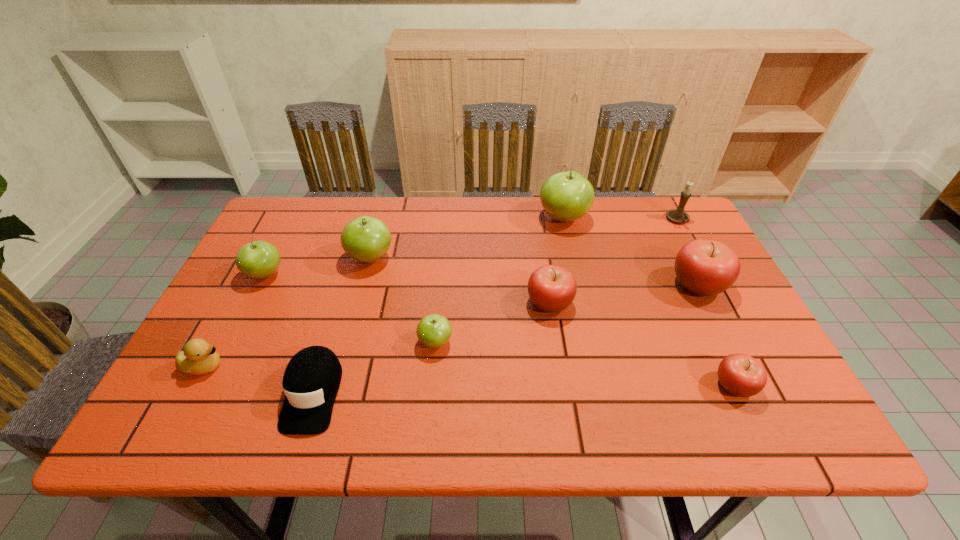
You are a GUI agent. You are given a task and a screenshot of the screen. Output one action in this format:
    pyautogui.click(x=<x>, y=<y>)
    Task: Click on the free space located 0.390m on the right of the leftmost red apple
    Image resolution: width=960 pixels, height=540 pixels.
    Given the screenshot: What is the action you would take?
    pyautogui.click(x=726, y=302)

You are a GUI agent. You are given a task and a screenshot of the screen. Output one action in this format:
    pyautogui.click(x=<x>, y=<y>)
    Task: Click on the vacant region located on the front of the second green apple from right to left
    This screenshot has height=540, width=960.
    Given the screenshot: What is the action you would take?
    pyautogui.click(x=429, y=412)

Where is `vacant space located 0.230m facing forward on the duckling`? The image size is (960, 540). vacant space located 0.230m facing forward on the duckling is located at coordinates (328, 366).

I want to click on vacant space located 0.280m on the back of the nearest red apple, so click(684, 280).

Where is `candle holder that is at the far edge`? The image size is (960, 540). candle holder that is at the far edge is located at coordinates (678, 215).

This screenshot has height=540, width=960. Find the location of `apple situated at the near edge`. apple situated at the near edge is located at coordinates tap(739, 374).

This screenshot has height=540, width=960. I want to click on cap that is at the near edge, so click(311, 380).

Where is `apple that is at the left edge`? apple that is at the left edge is located at coordinates (259, 259).

This screenshot has height=540, width=960. I want to click on duckling located in the left edge section of the desktop, so click(198, 357).

This screenshot has width=960, height=540. Identify the location of candle holder at the right edge. (678, 215).